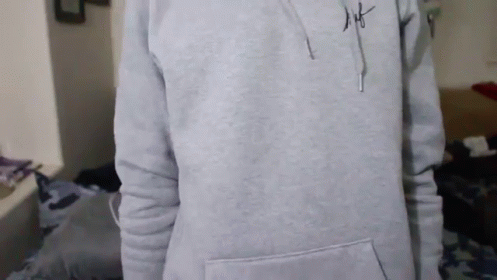
At what (x,y) coordinates should I click in order to perform the action: click on square tan pillow on the right. Please return your answer as a coordinate pair (x, y). This screenshot has width=497, height=280. Looking at the image, I should click on (416, 154).